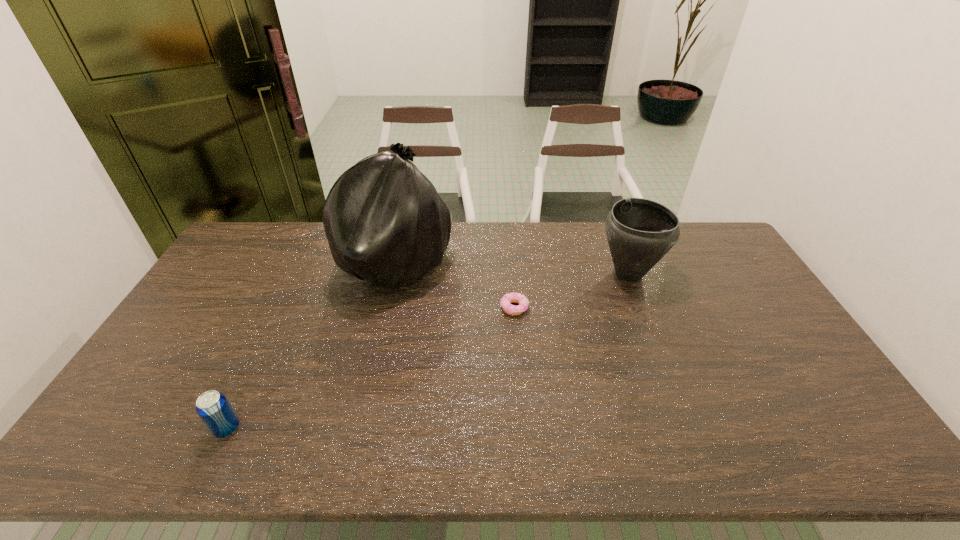
Where is `vacant space located on the right of the leftmost object`? The width and height of the screenshot is (960, 540). vacant space located on the right of the leftmost object is located at coordinates (343, 428).

What are the coordinates of `free space located 0.050m on the back of the third object from left to right` in the screenshot? It's located at (513, 287).

Where is `plastic bag that is at the far edge`? This screenshot has width=960, height=540. plastic bag that is at the far edge is located at coordinates (385, 223).

Find the location of a particular element. This screenshot has width=960, height=540. urn present at the far edge is located at coordinates pos(640,232).

Identify the location of object located at the near edge. The image size is (960, 540). (214, 409).

Locate an element on the screen. The height and width of the screenshot is (540, 960). vacant space at the far edge of the desktop is located at coordinates (575, 258).

The image size is (960, 540). Find the location of `vacant space at the near edge`. vacant space at the near edge is located at coordinates (235, 459).

Locate an element on the screen. The width and height of the screenshot is (960, 540). vacant area at the right edge is located at coordinates (758, 315).

Image resolution: width=960 pixels, height=540 pixels. What are the coordinates of `free region at the far right corner of the desktop` in the screenshot? It's located at (696, 232).

Where is `vacant area that lies between the plastic bag and the urn`? The height and width of the screenshot is (540, 960). vacant area that lies between the plastic bag and the urn is located at coordinates (512, 269).